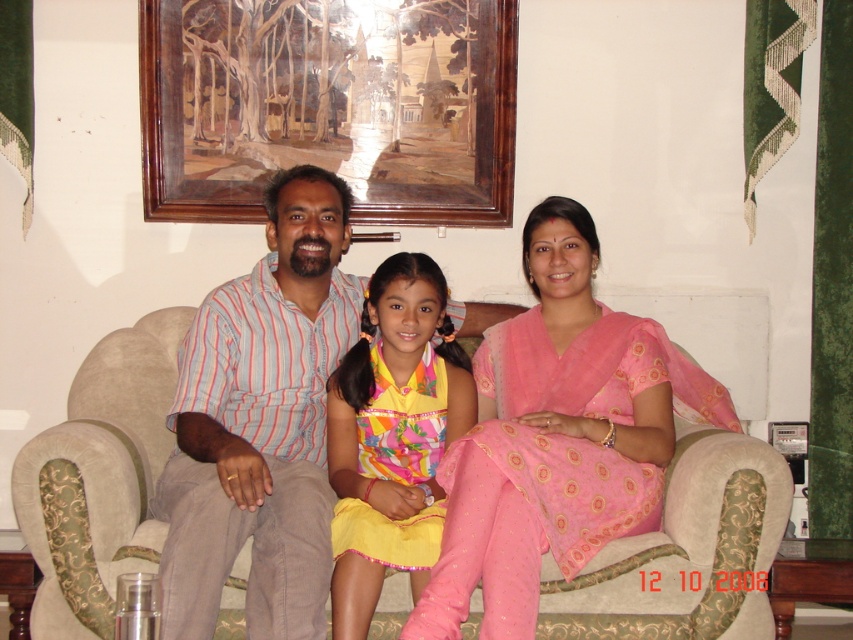
Measure the distance between point (694, 502) and camera.

A distance of 8.14 feet exists between point (694, 502) and camera.

Does beige fabric couch at center lie behind pink satin saree at center?

That is True.

Is point (776, 465) positioned behind point (462, 461)?

Yes, it is.

At what (x,y) coordinates should I click in order to perform the action: click on beige fabric couch at center. Please return your answer as a coordinate pair (x, y). The height and width of the screenshot is (640, 853). Looking at the image, I should click on (99, 477).

Looking at this image, is wooden picture frame at upper center thinner than pink satin saree at center?

Incorrect, wooden picture frame at upper center's width is not less than pink satin saree at center's.

Does point (315, 77) come farther from viewer compared to point (613, 381)?

Yes, it is behind point (613, 381).

Locate an element on the screen. The height and width of the screenshot is (640, 853). wooden picture frame at upper center is located at coordinates (329, 106).

Is beige fabric couch at center shorter than vibrant cotton dress at center?

Yes, beige fabric couch at center is shorter than vibrant cotton dress at center.

Between beige fabric couch at center and vibrant cotton dress at center, which one is positioned higher?

Positioned higher is vibrant cotton dress at center.

Locate an element on the screen. beige fabric couch at center is located at coordinates (99, 477).